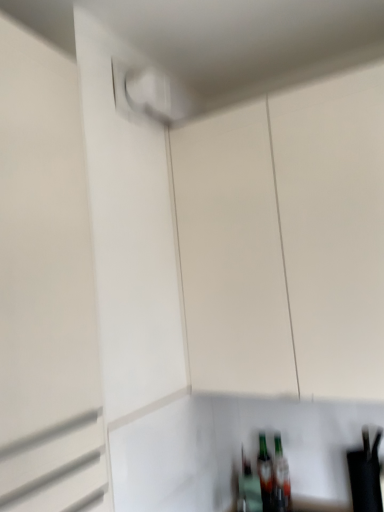
Question: Is white matte cabinet at center at the left side of white matte garage door at upper left?

Choices:
 (A) no
 (B) yes

Answer: (A)

Question: Can you confirm if white matte cabinet at center is smaller than white matte garage door at upper left?

Choices:
 (A) no
 (B) yes

Answer: (A)

Question: Does white matte cabinet at center appear on the right side of white matte garage door at upper left?

Choices:
 (A) yes
 (B) no

Answer: (A)

Question: From a real-world perspective, is white matte cabinet at center below white matte garage door at upper left?

Choices:
 (A) yes
 (B) no

Answer: (B)

Question: Is white matte cabinet at center facing towards white matte garage door at upper left?

Choices:
 (A) yes
 (B) no

Answer: (A)

Question: Is white matte cabinet at center bigger than white matte garage door at upper left?

Choices:
 (A) yes
 (B) no

Answer: (A)

Question: Is white matte garage door at upper left taller than white matte cabinet at center?

Choices:
 (A) yes
 (B) no

Answer: (A)

Question: From a real-world perspective, is white matte garage door at upper left on white matte cabinet at center?

Choices:
 (A) no
 (B) yes

Answer: (A)

Question: Is white matte garage door at upper left placed right next to white matte cabinet at center?

Choices:
 (A) no
 (B) yes

Answer: (A)

Question: Is white matte garage door at upper left aimed at white matte cabinet at center?

Choices:
 (A) yes
 (B) no

Answer: (B)

Question: Is white matte cabinet at center surrounded by white matte garage door at upper left?

Choices:
 (A) no
 (B) yes

Answer: (A)

Question: Considering the relative sizes of white matte garage door at upper left and white matte cabinet at center in the image provided, is white matte garage door at upper left bigger than white matte cabinet at center?

Choices:
 (A) yes
 (B) no

Answer: (B)

Question: In terms of size, does white matte cabinet at center appear bigger or smaller than white matte garage door at upper left?

Choices:
 (A) big
 (B) small

Answer: (A)